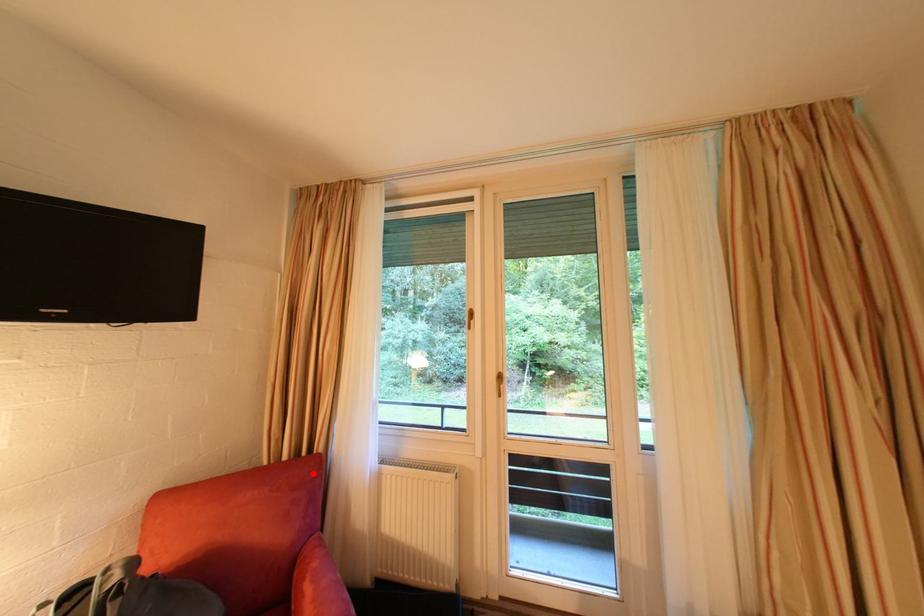
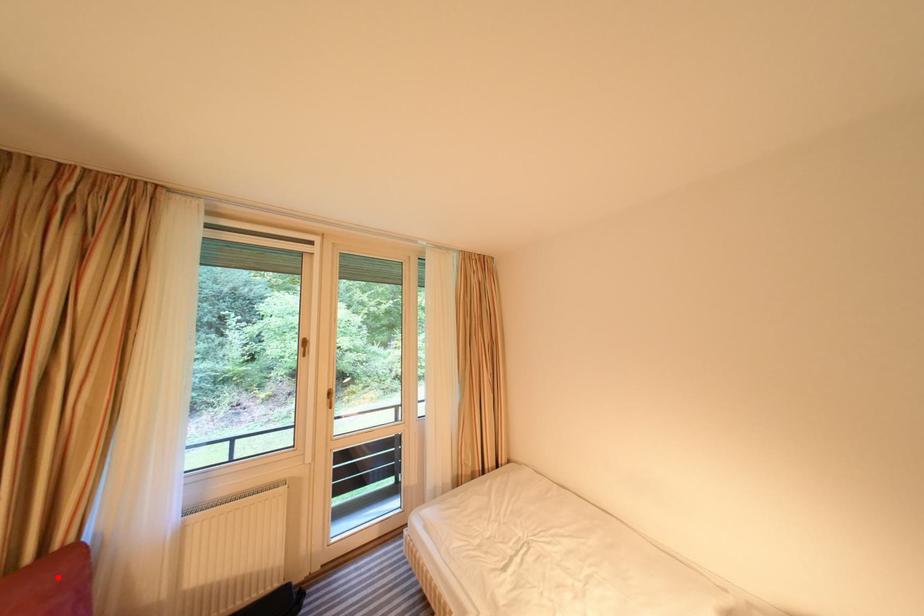
I am providing you with two images of the same scene from different viewpoints. A red point is marked on the first image and another point is marked on the second image. Is the marked point in image1 the same physical position as the marked point in image2?

Yes